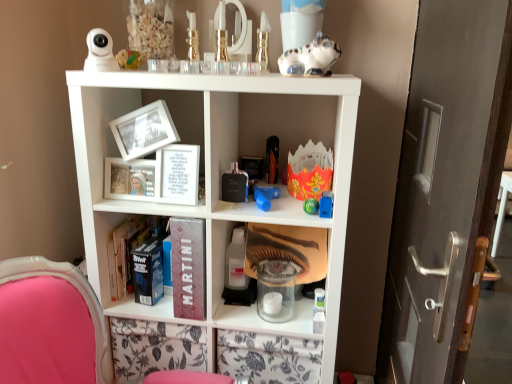
Locate an element on the screen. This screenshot has width=512, height=384. matte silver door handle at right is located at coordinates (446, 188).

I want to click on white glass candle at center, which is the 7th toy in left-to-right order, so click(275, 290).

What do you see at coordinates (275, 290) in the screenshot? I see `white glass candle at center, the ninth toy viewed from the top` at bounding box center [275, 290].

The image size is (512, 384). I want to click on white plastic toy at upper left, which is the third toy from top to bottom, so click(100, 52).

I want to click on transparent plastic candle at center, so click(289, 249).

Considering the sizes of objects shiny blue toy at center, the third toy positioned from the bottom, and transparent plastic bottle at center in the image provided, who is wider, shiny blue toy at center, the third toy positioned from the bottom, or transparent plastic bottle at center?

transparent plastic bottle at center is wider.

Is shiny blue toy at center, which is counted as the eighth toy, starting from the left, positioned before transparent plastic bottle at center?

Yes, it is.

In order to click on toiletry directly beneath the shiny blue toy at center, which ranks as the second toy in right-to-left order (from a real-world perspective) in this screenshot , I will do `click(236, 262)`.

Is white plastic toy at upper left, which is the seventh toy in bottom-to-top order, positioned in front of dark matte book at center, acting as the second book starting from the front?

Yes, white plastic toy at upper left, which is the seventh toy in bottom-to-top order, is in front of dark matte book at center, acting as the second book starting from the front.

From the picture: Who is smaller, white plastic toy at upper left, which is the seventh toy in bottom-to-top order, or dark matte book at center, the 2th book viewed from the top?

Smaller between the two is white plastic toy at upper left, which is the seventh toy in bottom-to-top order.

From a real-world perspective, which toy is the 7th one above the dark matte book at center, the 2th book viewed from the top? Please provide its 2D coordinates.

[(100, 52)]

Would you say white plastic toy at upper left, marked as the ninth toy in a right-to-left arrangement, is outside dark matte book at center, the 2th book viewed from the top?

Absolutely, white plastic toy at upper left, marked as the ninth toy in a right-to-left arrangement, is external to dark matte book at center, the 2th book viewed from the top.

Which of these two, matte black rectangular object at center, the 6th toy from the bottom, or gold metallic vase at upper center, acting as the first toy starting from the top, stands shorter?

With less height is matte black rectangular object at center, the 6th toy from the bottom.

From a real-world perspective, is matte black rectangular object at center, marked as the fourth toy in a right-to-left arrangement, beneath gold metallic vase at upper center, acting as the first toy starting from the top?

Correct, in the physical world, matte black rectangular object at center, marked as the fourth toy in a right-to-left arrangement, is lower than gold metallic vase at upper center, acting as the first toy starting from the top.

From the image's perspective, is matte black rectangular object at center, the 6th toy from the bottom, beneath gold metallic vase at upper center, the ninth toy positioned from the bottom?

Yes, from the image's perspective, matte black rectangular object at center, the 6th toy from the bottom, is below gold metallic vase at upper center, the ninth toy positioned from the bottom.

Is point (272, 150) positioned behind point (265, 36)?

Yes, point (272, 150) is farther from viewer.

Is matte black rectangular object at center, the sixth toy when ordered from left to right, closer to the viewer compared to transparent plastic bottle at center?

No, the depth of matte black rectangular object at center, the sixth toy when ordered from left to right, is greater than that of transparent plastic bottle at center.

Does matte black rectangular object at center, the sixth toy when ordered from left to right, appear on the right side of transparent plastic bottle at center?

Indeed, matte black rectangular object at center, the sixth toy when ordered from left to right, is positioned on the right side of transparent plastic bottle at center.

Are matte black rectangular object at center, marked as the fourth toy in a right-to-left arrangement, and transparent plastic bottle at center making contact?

No, matte black rectangular object at center, marked as the fourth toy in a right-to-left arrangement, is not next to transparent plastic bottle at center.

Considering the relative sizes of matte black rectangular object at center, marked as the fourth toy in a right-to-left arrangement, and transparent plastic bottle at center in the image provided, is matte black rectangular object at center, marked as the fourth toy in a right-to-left arrangement, shorter than transparent plastic bottle at center?

Indeed, matte black rectangular object at center, marked as the fourth toy in a right-to-left arrangement, has a lesser height compared to transparent plastic bottle at center.

Which object is closer to the camera taking this photo, white glass candle at center, the third toy viewed from the right, or matte black rectangular object at center, the 6th toy from the bottom?

white glass candle at center, the third toy viewed from the right, is more forward.

From a real-world perspective, is white glass candle at center, the ninth toy viewed from the top, physically located above or below matte black rectangular object at center, which appears as the 4th toy when viewed from the top?

Clearly, from a real-world perspective, white glass candle at center, the ninth toy viewed from the top, is below matte black rectangular object at center, which appears as the 4th toy when viewed from the top.

Considering the points (260, 297) and (274, 160), which point is behind, point (260, 297) or point (274, 160)?

The point (274, 160) is more distant.

From a real-world perspective, between dark matte book at center, positioned as the first book in bottom-to-top order, and white plastic toy at upper left, the 1th toy positioned from the left, who is vertically lower?

dark matte book at center, positioned as the first book in bottom-to-top order, is physically lower.

Is dark matte book at center, which ranks as the 1th book in back-to-front order, positioned before white plastic toy at upper left, which is the seventh toy in bottom-to-top order?

No, the depth of dark matte book at center, which ranks as the 1th book in back-to-front order, is greater than that of white plastic toy at upper left, which is the seventh toy in bottom-to-top order.

Is there a large distance between dark matte book at center, the 2th book viewed from the top, and white plastic toy at upper left, marked as the ninth toy in a right-to-left arrangement?

No, dark matte book at center, the 2th book viewed from the top, is not far from white plastic toy at upper left, marked as the ninth toy in a right-to-left arrangement.

Is point (194, 230) farther from viewer compared to point (89, 32)?

That is False.

Which is more to the right, transparent plastic candle at center or metallic black perfume at center, which ranks as the third toy in left-to-right order?

From the viewer's perspective, transparent plastic candle at center appears more on the right side.

Is transparent plastic candle at center not close to metallic black perfume at center, the 5th toy in the bottom-to-top sequence?

Actually, transparent plastic candle at center and metallic black perfume at center, the 5th toy in the bottom-to-top sequence, are a little close together.

Identify the location of cabinet located on the right of metallic black perfume at center, which ranks as the third toy in left-to-right order. (289, 249).

From a real-world perspective, is transparent plastic candle at center located beneath metallic black perfume at center, which ranks as the third toy in left-to-right order?

Yes, from a real-world perspective, transparent plastic candle at center is beneath metallic black perfume at center, which ranks as the third toy in left-to-right order.

Identify the location of toiletry that is on the left side of shiny blue toy at center, which ranks as the second toy in right-to-left order. (236, 262).

Starting from the white plastic toy at upper left, the 1th toy positioned from the left, which book is the 1st one to the right? Please provide its 2D coordinates.

[(187, 271)]

Estimate the real-world distances between objects in this image. Which object is further from rubber duck at upper left, the second toy when ordered from left to right, transparent plastic bottle at center or dark matte book at center, positioned as the first book in bottom-to-top order?

Based on the image, transparent plastic bottle at center appears to be further to rubber duck at upper left, the second toy when ordered from left to right.

From the image, which object appears to be farther from metallic black perfume at center, which ranks as the third toy in left-to-right order, white plastic toy at upper left, which is the third toy from top to bottom, or transparent plastic bottle at center?

Based on the image, white plastic toy at upper left, which is the third toy from top to bottom, appears to be further to metallic black perfume at center, which ranks as the third toy in left-to-right order.

Considering their positions, is matte black rectangular object at center, which appears as the 4th toy when viewed from the top, positioned further to white glass candle at center, which ranks as the first toy in bottom-to-top order, than rubber duck at upper left, the 2th toy in the top-to-bottom sequence?

rubber duck at upper left, the 2th toy in the top-to-bottom sequence, is positioned further to the anchor white glass candle at center, which ranks as the first toy in bottom-to-top order.

From the image, which object appears to be farther from metallic black perfume at center, the 5th toy in the bottom-to-top sequence, matte black rectangular object at center, marked as the fourth toy in a right-to-left arrangement, or white glass candle at center, the ninth toy viewed from the top?

The object further to metallic black perfume at center, the 5th toy in the bottom-to-top sequence, is white glass candle at center, the ninth toy viewed from the top.

Which object lies further to the anchor point white glass candle at center, which ranks as the first toy in bottom-to-top order, matte silver door handle at right or transparent plastic candle at center?

Based on the image, matte silver door handle at right appears to be further to white glass candle at center, which ranks as the first toy in bottom-to-top order.

Looking at the image, which one is located further to pink fabric swivel chair at lower left, blue plastic toy at center, acting as the eighth toy starting from the top, or white paper frame at center, arranged as the first book when viewed from the top?

blue plastic toy at center, acting as the eighth toy starting from the top, is positioned further to the anchor pink fabric swivel chair at lower left.

Estimate the real-world distances between objects in this image. Which object is further from transparent plastic candle at center, rubber duck at upper left, which is the eighth toy from bottom to top, or dark matte book at center, positioned as the first book in bottom-to-top order?

Based on the image, rubber duck at upper left, which is the eighth toy from bottom to top, appears to be further to transparent plastic candle at center.

Looking at the image, which one is located further to rubber duck at upper left, which is the eighth toy from right to left, white plastic toy at upper left, marked as the ninth toy in a right-to-left arrangement, or white paper frame at center, which is the 2th book in bottom-to-top order?

white paper frame at center, which is the 2th book in bottom-to-top order, is positioned further to the anchor rubber duck at upper left, which is the eighth toy from right to left.

This screenshot has width=512, height=384. Identify the location of cabinet between pink fabric swivel chair at lower left and matte black rectangular object at center, the 6th toy from the bottom, in the front-back direction. (289, 249).

You are a GUI agent. You are given a task and a screenshot of the screen. Output one action in this format:
    pyautogui.click(x=<x>, y=<y>)
    Task: Click on the cabinet between white plastic toy at upper left, marked as the ninth toy in a right-to-left arrangement, and dark matte book at center, the 2th book viewed from the top, in the up-down direction
    The width and height of the screenshot is (512, 384).
    Given the screenshot: What is the action you would take?
    pyautogui.click(x=289, y=249)

At what (x,y) coordinates should I click in order to perform the action: click on book between matte black rectangular object at center, marked as the fourth toy in a right-to-left arrangement, and transparent plastic bottle at center in the up-down direction. Please return your answer as a coordinate pair (x, y). Looking at the image, I should click on (178, 174).

Find the location of a particular element. The image size is (512, 384). toiletry located between dark matte book at center, positioned as the first book in bottom-to-top order, and shiny blue toy at center, the third toy positioned from the bottom, in the left-right direction is located at coordinates (236, 262).